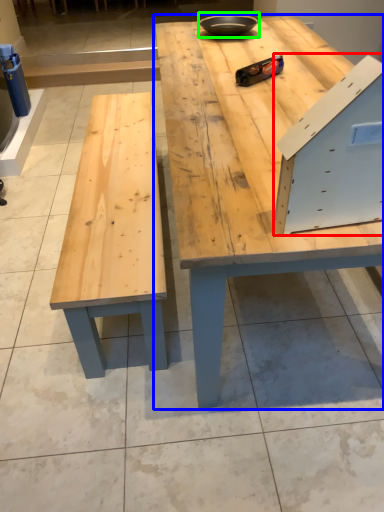
Question: Based on their relative distances, which object is nearer to drawer (highlighted by a red box)? Choose from table (highlighted by a blue box) and bowl (highlighted by a green box).

Choices:
 (A) table
 (B) bowl

Answer: (A)